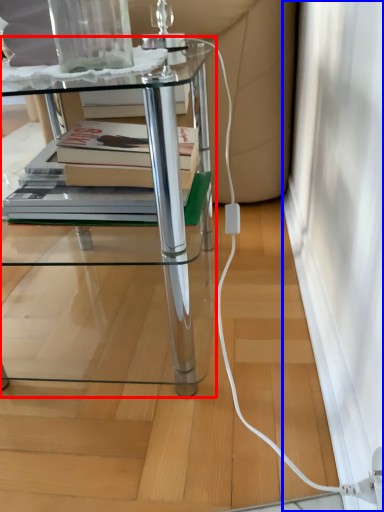
Question: Among these objects, which one is nearest to the camera, table (highlighted by a red box) or screen door (highlighted by a blue box)?

Choices:
 (A) table
 (B) screen door

Answer: (A)